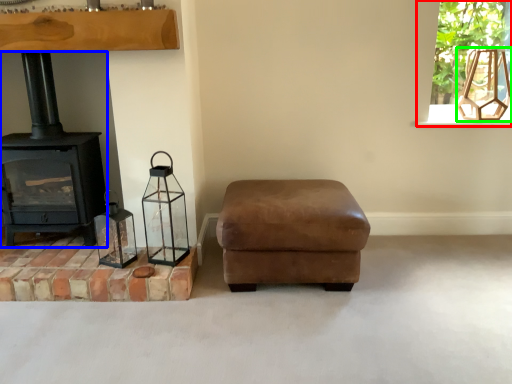
Question: Which object is positioned closest to window frame (highlighted by a red box)? Select from wood burning stove (highlighted by a blue box) and lamp (highlighted by a green box).

Choices:
 (A) wood burning stove
 (B) lamp

Answer: (B)